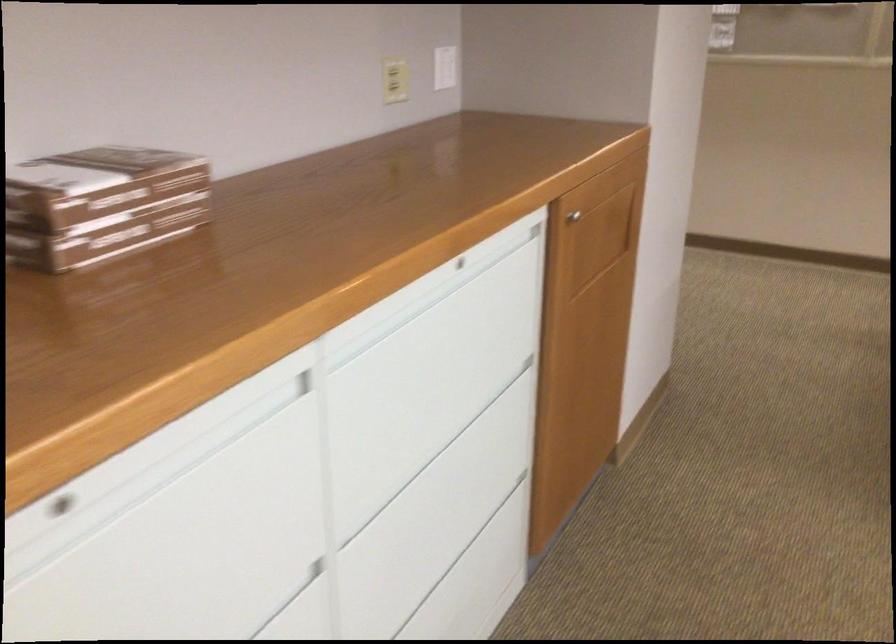
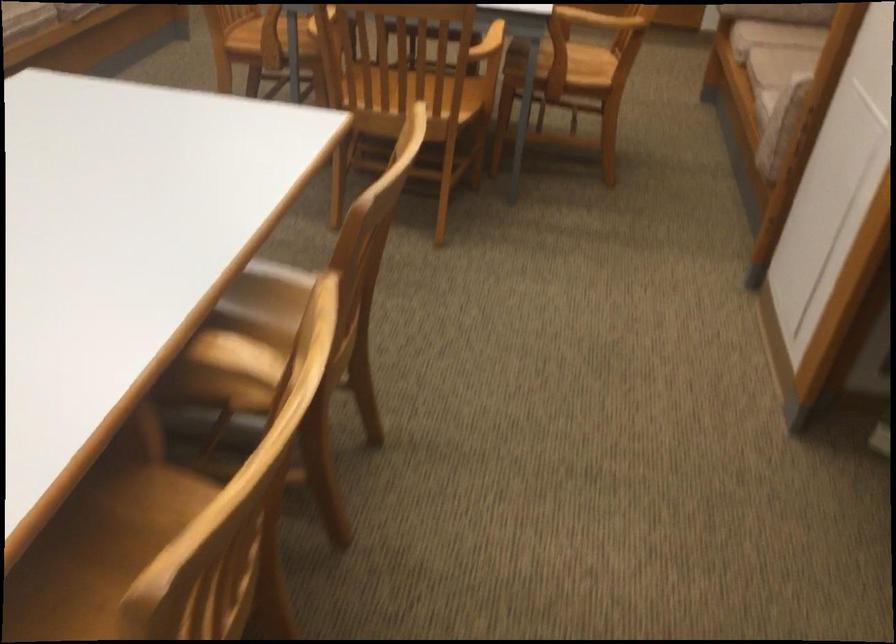
First-person continuous shooting, in which direction is the camera rotating?

The rotation direction of the camera is right-down.